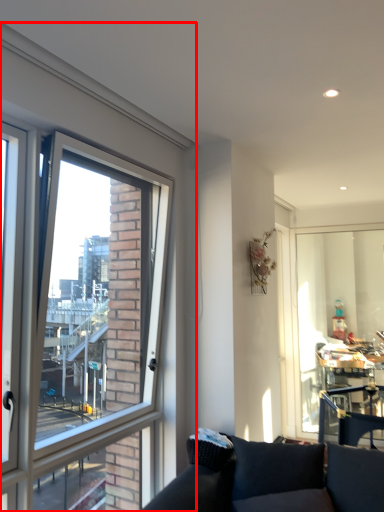
Question: From the image's perspective, what is the correct spatial relationship of window (annotated by the red box) in relation to window screen?

Choices:
 (A) below
 (B) above

Answer: (B)